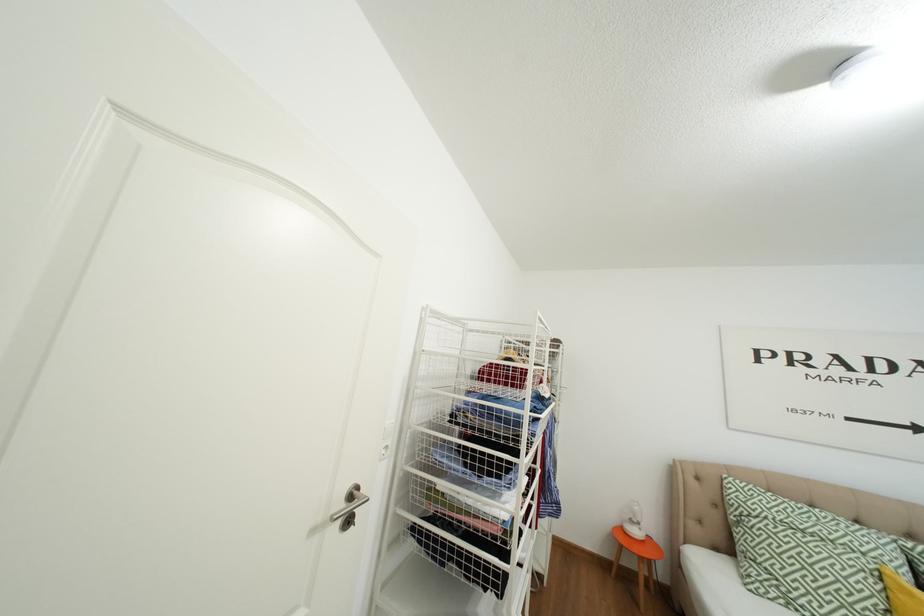
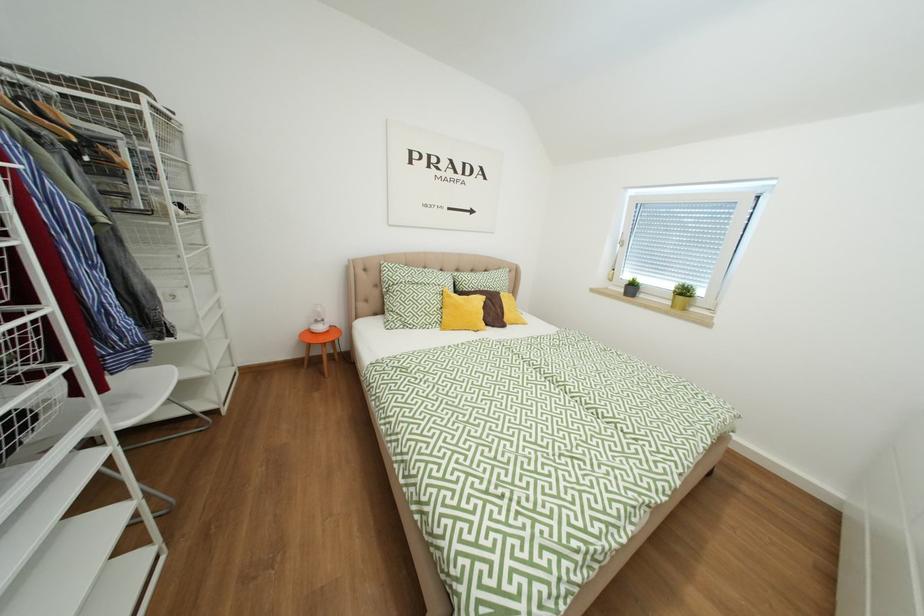
The first image is from the beginning of the video and the second image is from the end. How did the camera likely rotate when shooting the video?

The camera's rotation is toward right-down.